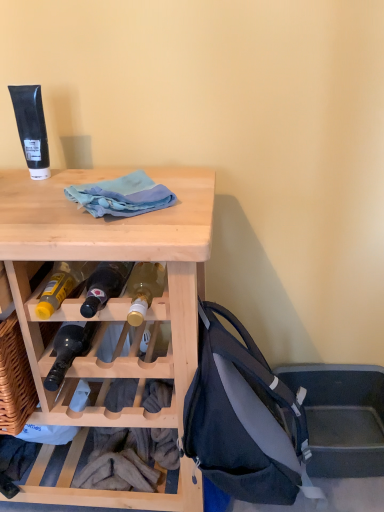
Find the location of a particular element. The width and height of the screenshot is (384, 512). vacant space to the right of light blue fabric at center is located at coordinates (190, 197).